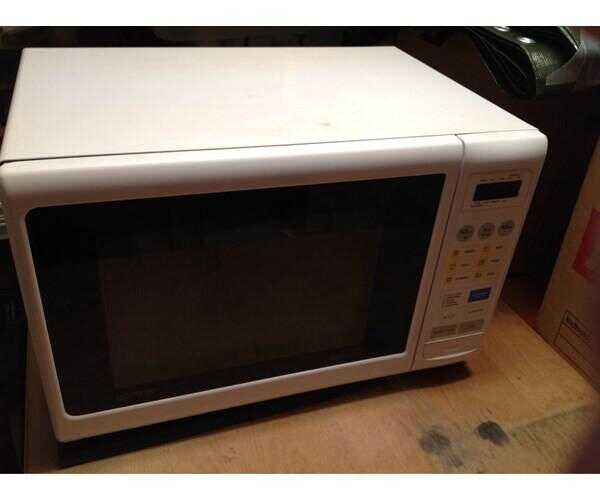
Identify the location of 1 door on microwave. (345, 177).